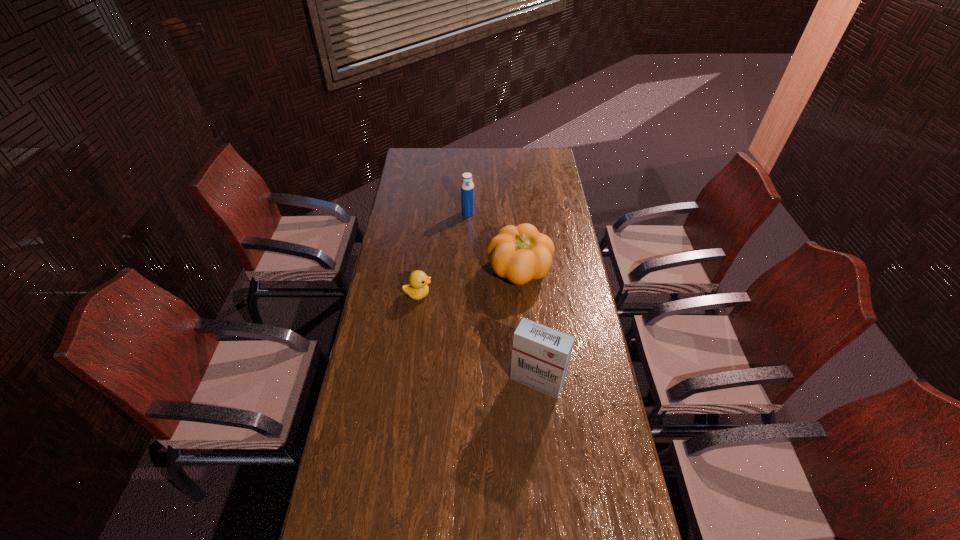
Identify the location of free space between the duck and the farthest object. (443, 254).

Image resolution: width=960 pixels, height=540 pixels. I want to click on free spot between the farthest object and the shortest object, so click(443, 254).

The height and width of the screenshot is (540, 960). I want to click on object that is the second closest to the pumpkin, so click(x=467, y=187).

Image resolution: width=960 pixels, height=540 pixels. Find the location of `the third closest object to the cigarette case`. the third closest object to the cigarette case is located at coordinates (467, 187).

Find the location of a particular element. Image resolution: width=960 pixels, height=540 pixels. free space that satisfies the following two spatial constraints: 1. on the face of the leftmost object; 2. on the right side of the cigarette case is located at coordinates (407, 381).

Where is `free location that satisfies the following two spatial constraints: 1. on the front side of the third object from right to left; 2. on the left side of the cigarette case`? The width and height of the screenshot is (960, 540). free location that satisfies the following two spatial constraints: 1. on the front side of the third object from right to left; 2. on the left side of the cigarette case is located at coordinates (463, 381).

Where is `vacant position in the image that satisfies the following two spatial constraints: 1. on the front side of the water bottle; 2. on the left side of the nearest object`? vacant position in the image that satisfies the following two spatial constraints: 1. on the front side of the water bottle; 2. on the left side of the nearest object is located at coordinates (463, 381).